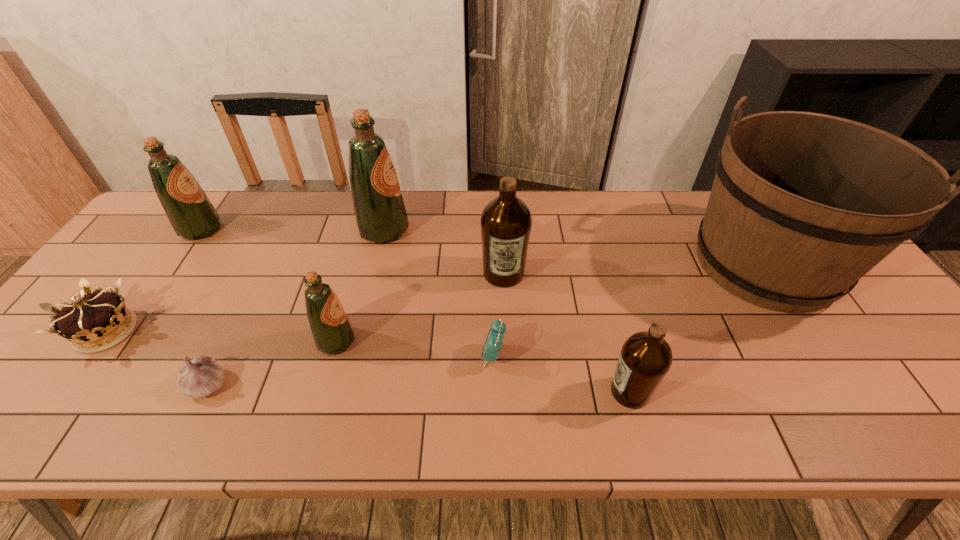
Locate an element on the screen. The height and width of the screenshot is (540, 960). the third closest object relative to the nearest green olive oil is located at coordinates (493, 344).

Select which object appears as the fifth closest to the biggest green olive oil. Please provide its 2D coordinates. Your answer should be formatted as a tuple, i.e. [(x, y)], where the tuple contains the x and y coordinates of a point satisfying the conditions above.

[(202, 376)]

Where is `the closest olive oil to the rightmost olive oil`? This screenshot has width=960, height=540. the closest olive oil to the rightmost olive oil is located at coordinates pyautogui.click(x=506, y=221).

Where is `olive oil that is the third closest to the crown`? This screenshot has width=960, height=540. olive oil that is the third closest to the crown is located at coordinates (380, 214).

I want to click on green olive oil that is the third closest one to the gold crown, so click(380, 214).

Find the location of `the second closest green olive oil to the farther brown olive oil`. the second closest green olive oil to the farther brown olive oil is located at coordinates (331, 329).

Identify the location of vacant space that satisfies the following two spatial constraints: 1. on the front-facing side of the leftmost olive oil; 2. on the back side of the third object from left to right. The width and height of the screenshot is (960, 540). (95, 384).